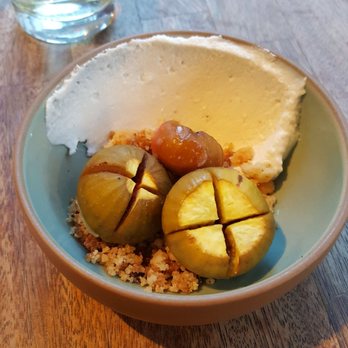
Identify the location of glass. This screenshot has width=348, height=348. (45, 37).